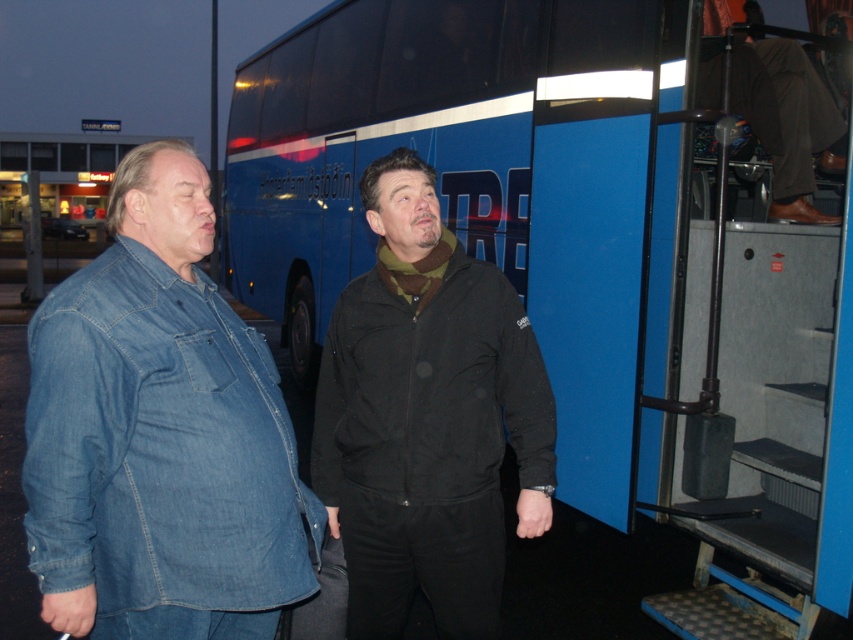
Question: Which object is closer to the camera taking this photo?

Choices:
 (A) denim jacket at left
 (B) brown leather jacket at upper right
 (C) blue matte bus at center
 (D) black textured jacket at center

Answer: (A)

Question: Which object appears farthest from the camera in this image?

Choices:
 (A) blue matte bus at center
 (B) denim jacket at left
 (C) brown leather jacket at upper right
 (D) black textured jacket at center

Answer: (C)

Question: Which point appears farthest from the camera in this image?

Choices:
 (A) (614, 508)
 (B) (433, 310)
 (C) (48, 444)
 (D) (821, 84)

Answer: (D)

Question: Does blue matte bus at center appear over black textured jacket at center?

Choices:
 (A) no
 (B) yes

Answer: (A)

Question: Is black textured jacket at center further to the viewer compared to brown leather jacket at upper right?

Choices:
 (A) no
 (B) yes

Answer: (A)

Question: Is denim jacket at left to the left of brown leather jacket at upper right from the viewer's perspective?

Choices:
 (A) yes
 (B) no

Answer: (A)